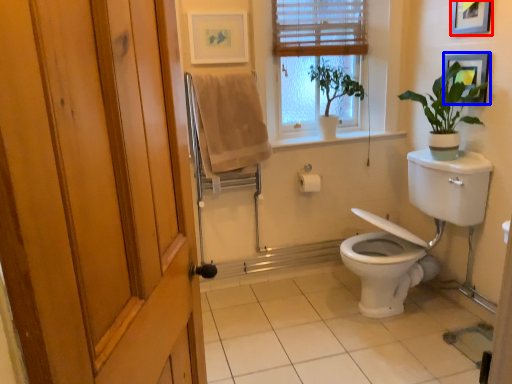
Question: Which of the following is the closest to the observer, picture frame (highlighted by a red box) or picture frame (highlighted by a blue box)?

Choices:
 (A) picture frame
 (B) picture frame

Answer: (A)